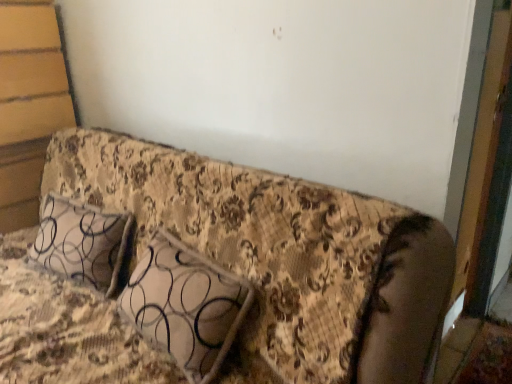
Looking at this image, what is the approximate width of floral fabric couch at center?

floral fabric couch at center is 3.34 feet in width.

What do you see at coordinates (268, 250) in the screenshot?
I see `floral fabric couch at center` at bounding box center [268, 250].

This screenshot has width=512, height=384. What are the coordinates of `floral fabric couch at center` in the screenshot? It's located at (268, 250).

Looking at this image, measure the distance between patterned fabric pillow at center and camera.

patterned fabric pillow at center and camera are 3.96 feet apart.

The width and height of the screenshot is (512, 384). What do you see at coordinates (185, 305) in the screenshot?
I see `patterned fabric pillow at center` at bounding box center [185, 305].

What is the approximate height of patterned fabric pillow at center?

The height of patterned fabric pillow at center is 25.12 inches.

The height and width of the screenshot is (384, 512). In order to click on patterned fabric pillow at center in this screenshot , I will do `click(185, 305)`.

Image resolution: width=512 pixels, height=384 pixels. In order to click on floral fabric couch at center in this screenshot , I will do `click(268, 250)`.

Is patterned fabric pillow at center at the left side of floral fabric couch at center?

No, patterned fabric pillow at center is not to the left of floral fabric couch at center.

Who is more distant, patterned fabric pillow at center or floral fabric couch at center?

patterned fabric pillow at center.

Does point (199, 254) appear closer or farther from the camera than point (330, 276)?

Clearly, point (199, 254) is more distant from the camera than point (330, 276).

From the image's perspective, which one is positioned lower, patterned fabric pillow at center or floral fabric couch at center?

floral fabric couch at center.

From a real-world perspective, is patterned fabric pillow at center over floral fabric couch at center?

Indeed, from a real-world perspective, patterned fabric pillow at center stands above floral fabric couch at center.

Considering the relative sizes of patterned fabric pillow at center and floral fabric couch at center in the image provided, is patterned fabric pillow at center wider than floral fabric couch at center?

Incorrect, the width of patterned fabric pillow at center does not surpass that of floral fabric couch at center.

Can you confirm if patterned fabric pillow at center is shorter than floral fabric couch at center?

Yes, patterned fabric pillow at center is shorter than floral fabric couch at center.

Considering the sizes of patterned fabric pillow at center and floral fabric couch at center in the image, is patterned fabric pillow at center bigger or smaller than floral fabric couch at center?

Clearly, patterned fabric pillow at center is smaller in size than floral fabric couch at center.

Would you say patterned fabric pillow at center is outside floral fabric couch at center?

No, patterned fabric pillow at center is inside floral fabric couch at center's boundary.

Is patterned fabric pillow at center with floral fabric couch at center?

No, patterned fabric pillow at center is not with floral fabric couch at center.

Could you tell me if patterned fabric pillow at center is turned towards floral fabric couch at center?

Yes, patterned fabric pillow at center is aimed at floral fabric couch at center.

Measure the distance between patterned fabric pillow at center and floral fabric couch at center.

patterned fabric pillow at center is 7.64 inches away from floral fabric couch at center.

Identify the location of furniture in front of the patterned fabric pillow at center. Image resolution: width=512 pixels, height=384 pixels. (268, 250).

Does floral fabric couch at center appear on the left side of patterned fabric pillow at center?

Yes.

Considering the positions of objects floral fabric couch at center and patterned fabric pillow at center in the image provided, who is in front, floral fabric couch at center or patterned fabric pillow at center?

floral fabric couch at center is more forward.

Considering the positions of point (132, 365) and point (173, 333), is point (132, 365) closer or farther from the camera than point (173, 333)?

Point (132, 365) is positioned farther from the camera compared to point (173, 333).

From the image's perspective, is floral fabric couch at center on top of patterned fabric pillow at center?

Actually, floral fabric couch at center appears below patterned fabric pillow at center in the image.

Looking at this image, from a real-world perspective, which is physically above, floral fabric couch at center or patterned fabric pillow at center?

patterned fabric pillow at center is physically above.

Considering the sizes of objects floral fabric couch at center and patterned fabric pillow at center in the image provided, who is wider, floral fabric couch at center or patterned fabric pillow at center?

Wider between the two is floral fabric couch at center.

Can you confirm if floral fabric couch at center is shorter than patterned fabric pillow at center?

No, floral fabric couch at center is not shorter than patterned fabric pillow at center.

Is floral fabric couch at center bigger than patterned fabric pillow at center?

Yes, floral fabric couch at center is bigger than patterned fabric pillow at center.

Is patterned fabric pillow at center surrounded by floral fabric couch at center?

Yes.

Are floral fabric couch at center and patterned fabric pillow at center far apart?

No, there isn't a large distance between floral fabric couch at center and patterned fabric pillow at center.

Is floral fabric couch at center oriented towards patterned fabric pillow at center?

Yes, floral fabric couch at center faces towards patterned fabric pillow at center.

Locate an element on the screen. pillow above the floral fabric couch at center (from a real-world perspective) is located at coordinates (185, 305).

In order to click on pillow that appears on the right of floral fabric couch at center in this screenshot , I will do `click(185, 305)`.

The image size is (512, 384). Find the location of `pillow above the floral fabric couch at center (from a real-world perspective)`. pillow above the floral fabric couch at center (from a real-world perspective) is located at coordinates (185, 305).